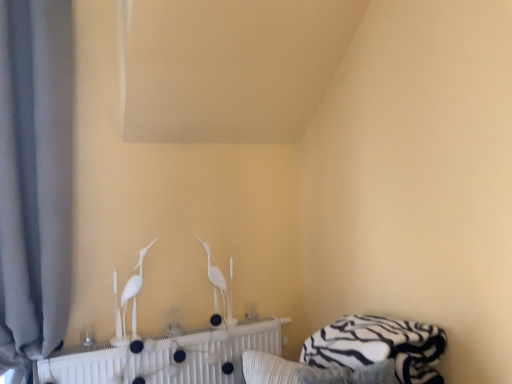
Question: Could you tell me if white glossy bird at center, arranged as the 1th bird when viewed from the right, is facing white zebra-patterned bed at lower right?

Choices:
 (A) no
 (B) yes

Answer: (B)

Question: From the image's perspective, is white glossy bird at center, the first bird positioned from the back, located above white zebra-patterned bed at lower right?

Choices:
 (A) no
 (B) yes

Answer: (B)

Question: Can you confirm if white glossy bird at center, arranged as the 1th bird when viewed from the right, is thinner than white zebra-patterned bed at lower right?

Choices:
 (A) yes
 (B) no

Answer: (A)

Question: Is white glossy bird at center, arranged as the 1th bird when viewed from the right, not inside white zebra-patterned bed at lower right?

Choices:
 (A) no
 (B) yes

Answer: (B)

Question: Is white zebra-patterned bed at lower right a part of white glossy bird at center, the first bird positioned from the back?

Choices:
 (A) no
 (B) yes

Answer: (A)

Question: From the image's perspective, does white glossy bird at center, the first bird positioned from the back, appear lower than white zebra-patterned bed at lower right?

Choices:
 (A) yes
 (B) no

Answer: (B)

Question: Is gray fabric curtain at left shorter than white glossy bird at center, the first bird positioned from the back?

Choices:
 (A) yes
 (B) no

Answer: (B)

Question: From a real-world perspective, is gray fabric curtain at left below white glossy bird at center, the first bird positioned from the back?

Choices:
 (A) no
 (B) yes

Answer: (A)

Question: Is the position of gray fabric curtain at left more distant than that of white glossy bird at center, arranged as the 1th bird when viewed from the right?

Choices:
 (A) no
 (B) yes

Answer: (A)

Question: Does gray fabric curtain at left have a greater height compared to white glossy bird at center, the first bird positioned from the back?

Choices:
 (A) yes
 (B) no

Answer: (A)

Question: Could white glossy bird at center, arranged as the 1th bird when viewed from the right, be considered to be inside gray fabric curtain at left?

Choices:
 (A) yes
 (B) no

Answer: (B)

Question: Does gray fabric curtain at left have a lesser width compared to white glossy bird at center, positioned as the second bird in front-to-back order?

Choices:
 (A) no
 (B) yes

Answer: (A)

Question: Is white matte radiator at center oriented away from white glossy bird at center, the first bird when ordered from left to right?

Choices:
 (A) yes
 (B) no

Answer: (B)